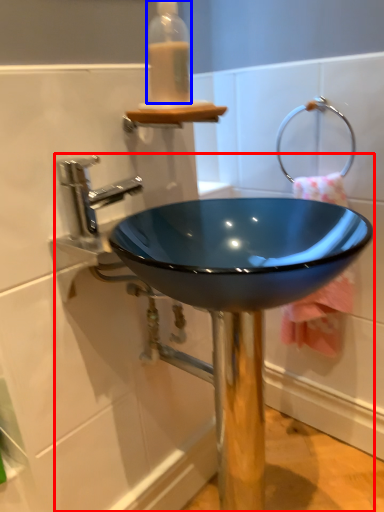
Question: Which of the following is the closest to the observer, sink (highlighted by a red box) or bottle (highlighted by a blue box)?

Choices:
 (A) sink
 (B) bottle

Answer: (A)